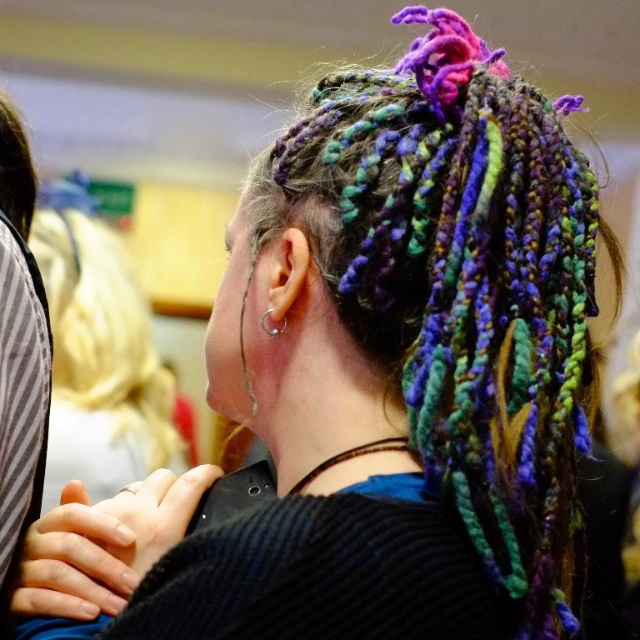
Question: Which of the following is the farthest from the observer?

Choices:
 (A) silver metallic ring at ear
 (B) multicolored braids at upper center

Answer: (B)

Question: Can you confirm if multicolored braids at upper center is positioned below silver metallic ring at ear?

Choices:
 (A) yes
 (B) no

Answer: (A)

Question: Can you confirm if multicolored braids at upper center is wider than silver metallic ring at ear?

Choices:
 (A) yes
 (B) no

Answer: (A)

Question: Can you confirm if multicolored braids at upper center is bigger than silver metallic ring at ear?

Choices:
 (A) no
 (B) yes

Answer: (B)